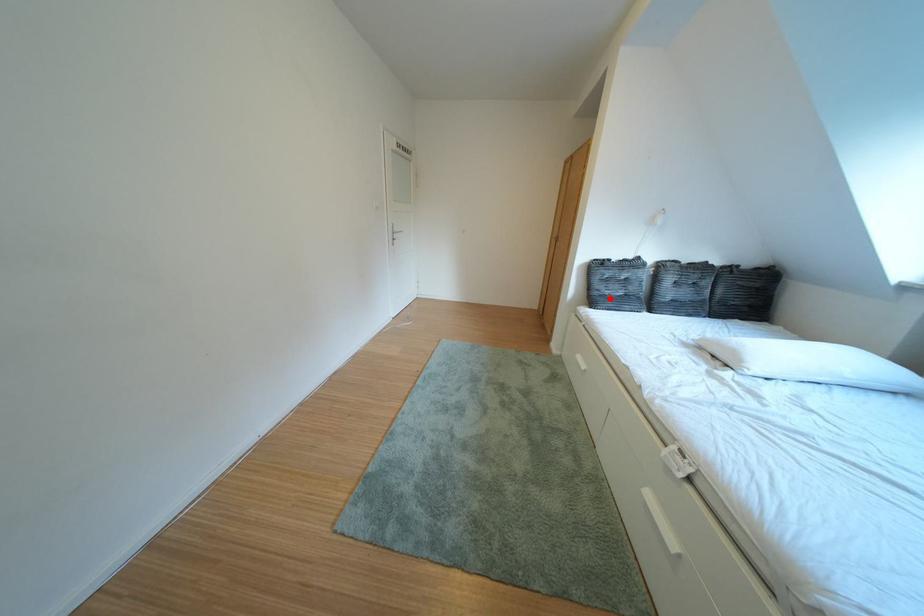
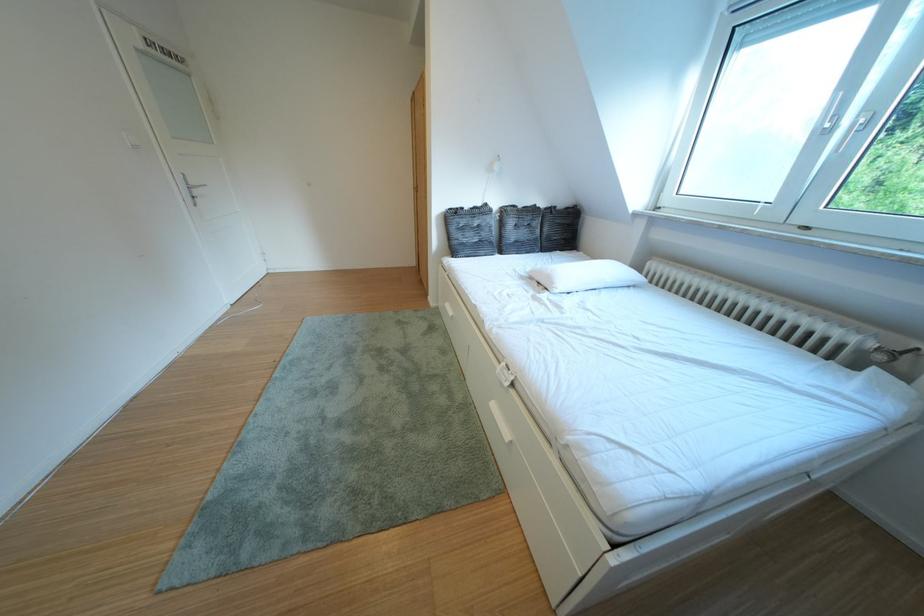
Locate, in the second image, the point that corresponds to the highlighted location in the first image.

(468, 246)